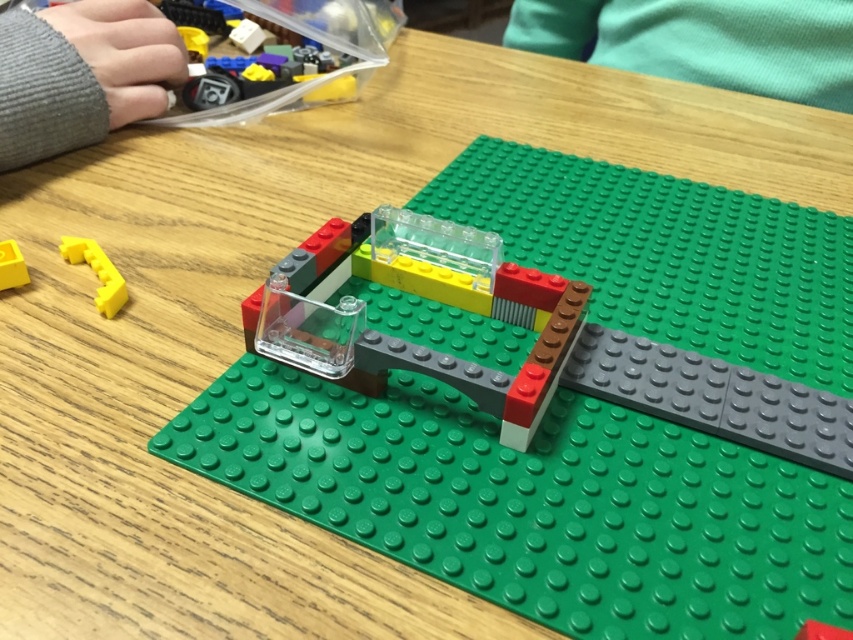
Where is the matte yellow plastic piece at lower left located in the image?

The matte yellow plastic piece at lower left is located at point (96, 273).

You are holding a camera and want to take a photo of the matte yellow plastic piece at lower left. If the camera is currently 27.33 inches away from the piece, is it within the recommended focusing distance of 24 inches for clear photos?

The matte yellow plastic piece at lower left and camera are 27.33 inches apart from each other. Since the recommended focusing distance is 24 inches, the current distance is beyond the recommended range, so the photo may not be clear.

Consider the image. You are building a LEGO structure and need to choose between the matte yellow plastic piece at lower left and the yellow matte plastic piece at lower left. Which one is taller?

The matte yellow plastic piece at lower left has a greater height compared to the yellow matte plastic piece at lower left.